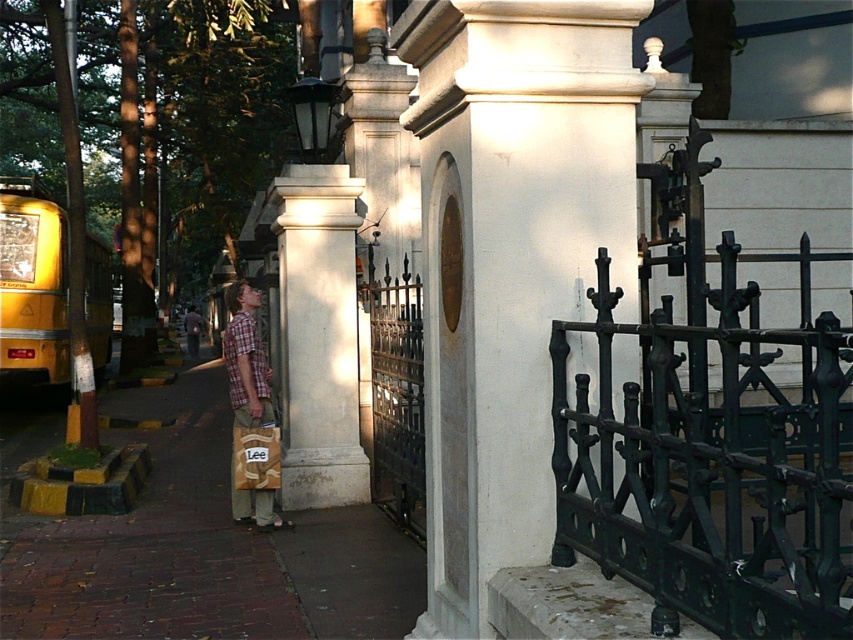
Between white stone pillar at center and yellow metallic school bus at left, which one has less height?

white stone pillar at center

Who is lower down, white stone pillar at center or yellow metallic school bus at left?

Positioned lower is white stone pillar at center.

Between point (613, 28) and point (85, 316), which one is positioned in front?

Point (613, 28) is in front.

Image resolution: width=853 pixels, height=640 pixels. I want to click on white stone pillar at center, so click(509, 259).

Who is taller, white stone pillar at center or green wrought iron gate at center?

white stone pillar at center

Who is positioned more to the left, white stone pillar at center or green wrought iron gate at center?

Positioned to the left is white stone pillar at center.

Does point (593, 234) come behind point (705, 404)?

Yes, point (593, 234) is behind point (705, 404).

The height and width of the screenshot is (640, 853). Identify the location of white stone pillar at center. (509, 259).

Between green wrought iron gate at center and brick pavement at lower left, which one has more height?

green wrought iron gate at center

Between point (769, 564) and point (160, 621), which one is positioned in front?

Point (769, 564) is more forward.

In order to click on green wrought iron gate at center in this screenshot , I will do click(x=712, y=456).